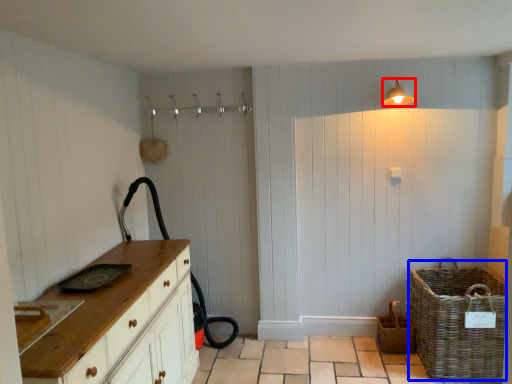
Question: Which object appears closest to the camera in this image, light fixture (highlighted by a red box) or basket (highlighted by a blue box)?

Choices:
 (A) light fixture
 (B) basket

Answer: (B)